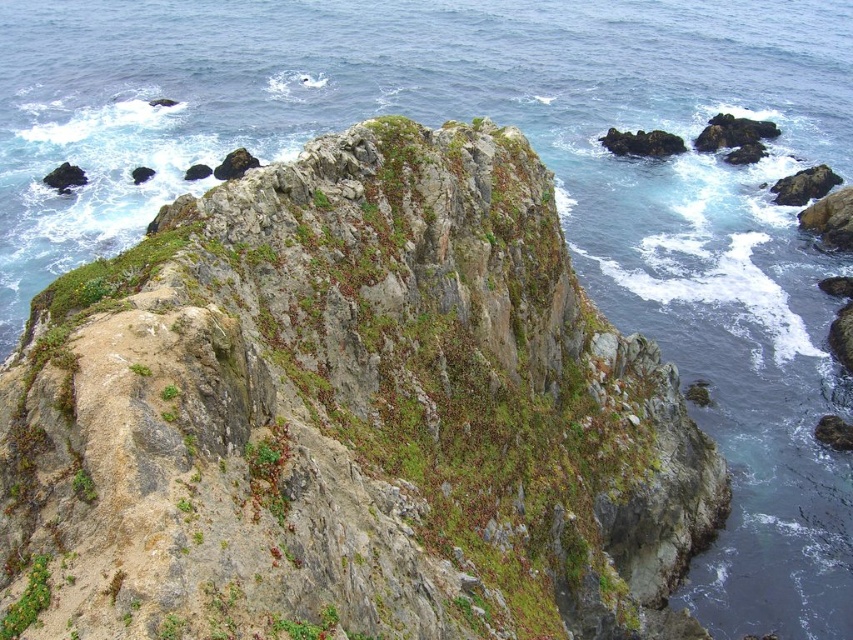
Between point (119, 529) and point (3, 630), which one is positioned in front?

Positioned in front is point (3, 630).

Can you confirm if green mossy rock at center is smaller than green mossy rock at lower left?

No.

Find the location of a particular element. This screenshot has height=640, width=853. green mossy rock at center is located at coordinates (347, 416).

Identify the location of green mossy rock at center. (347, 416).